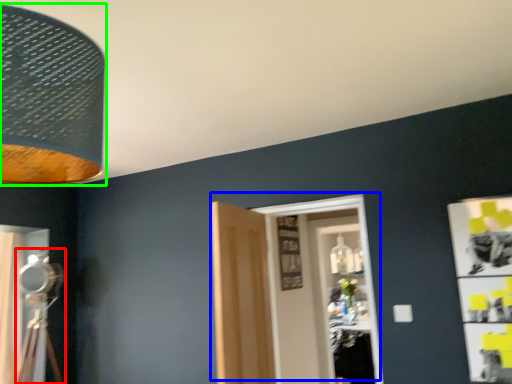
Question: Which object is positioned closest to table lamp (highlighted by a red box)? Select from door (highlighted by a blue box) and lamp (highlighted by a green box).

Choices:
 (A) door
 (B) lamp

Answer: (A)